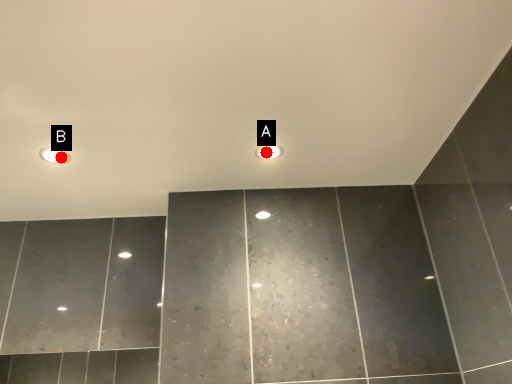
Question: Two points are circled on the image, labeled by A and B beside each circle. Which point is closer to the camera?

Choices:
 (A) A is closer
 (B) B is closer

Answer: (B)